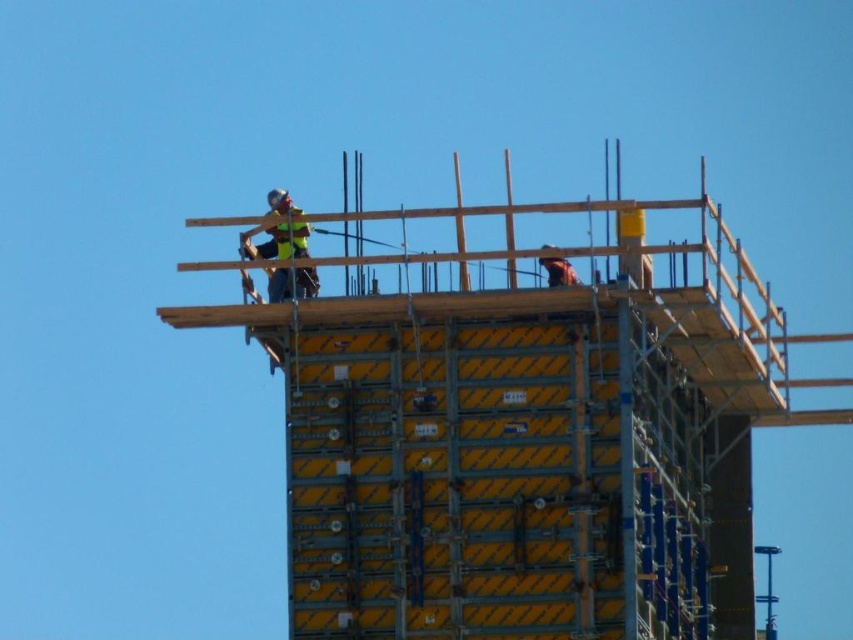
Between point (518, 410) and point (299, 230), which one is positioned in front?

Point (518, 410) is more forward.

Is point (453, 516) positioned behind point (267, 288)?

No, it is not.

Does point (643, 372) come behind point (297, 225)?

That is False.

In order to click on yellow metallic scaffolding at upper center in this screenshot , I will do `click(523, 429)`.

Is yellow reflective vest at upper center bigger than yellow reflective safety vest at upper center?

Indeed, yellow reflective vest at upper center has a larger size compared to yellow reflective safety vest at upper center.

You are a GUI agent. You are given a task and a screenshot of the screen. Output one action in this format:
    pyautogui.click(x=<x>, y=<y>)
    Task: Click on the yellow reflective vest at upper center
    This screenshot has height=640, width=853.
    Given the screenshot: What is the action you would take?
    pyautogui.click(x=277, y=230)

Does yellow reflective safety vest at upper center have a smaller size compared to brown leather helmet at upper right?

Correct, yellow reflective safety vest at upper center occupies less space than brown leather helmet at upper right.

Who is higher up, yellow reflective safety vest at upper center or brown leather helmet at upper right?

yellow reflective safety vest at upper center is higher up.

Which is behind, point (281, 236) or point (560, 269)?

The point (281, 236) is more distant.

Identify the location of yellow reflective safety vest at upper center. The image size is (853, 640). (289, 237).